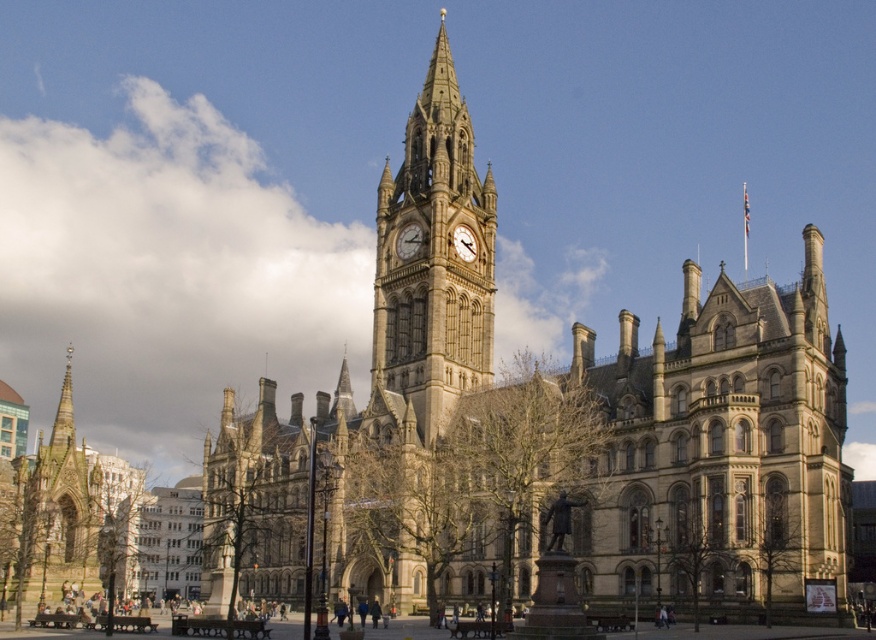
Question: Which point appears closest to the camera in this image?

Choices:
 (A) (411, 244)
 (B) (767, 340)
 (C) (461, 228)
 (D) (422, 422)

Answer: (B)

Question: Does golden stone clock tower at center have a larger size compared to golden stone clock at center?

Choices:
 (A) no
 (B) yes

Answer: (B)

Question: Can you confirm if golden stone clock tower at center is positioned above golden stone clock at center?

Choices:
 (A) no
 (B) yes

Answer: (B)

Question: Is golden stone clock tower at center above golden stone clock at center?

Choices:
 (A) no
 (B) yes

Answer: (B)

Question: Which of these objects is positioned farthest from the golden stone clock tower at center?

Choices:
 (A) stone clock tower at center
 (B) matte gray clock at center

Answer: (B)

Question: Which point is farther from the camera taking this photo?

Choices:
 (A) (397, 256)
 (B) (394, 381)

Answer: (A)